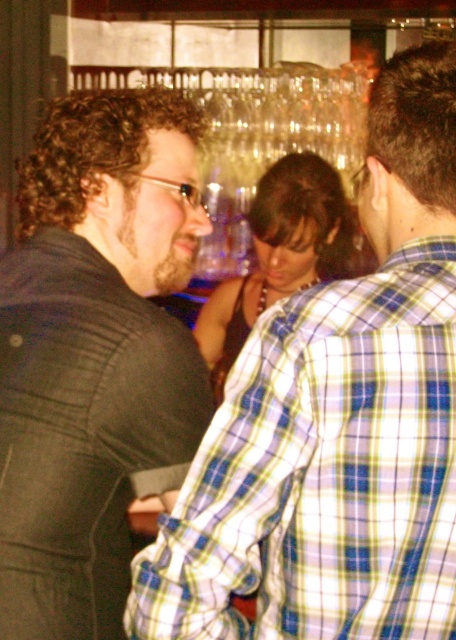
Question: Which of these objects is positioned farthest from the matte black dress at center?

Choices:
 (A) blue plaid shirt at center
 (B) dark gray suit at left

Answer: (A)

Question: Does blue plaid shirt at center appear under matte black dress at center?

Choices:
 (A) no
 (B) yes

Answer: (B)

Question: Which point appears closest to the camera in this image?

Choices:
 (A) (167, 323)
 (B) (306, 465)
 (C) (250, 224)

Answer: (B)

Question: Does blue plaid shirt at center appear on the left side of dark gray suit at left?

Choices:
 (A) no
 (B) yes

Answer: (A)

Question: Is dark gray suit at left to the left of matte black dress at center from the viewer's perspective?

Choices:
 (A) no
 (B) yes

Answer: (B)

Question: Which object appears farthest from the camera in this image?

Choices:
 (A) blue plaid shirt at center
 (B) matte black dress at center
 (C) dark gray suit at left

Answer: (B)